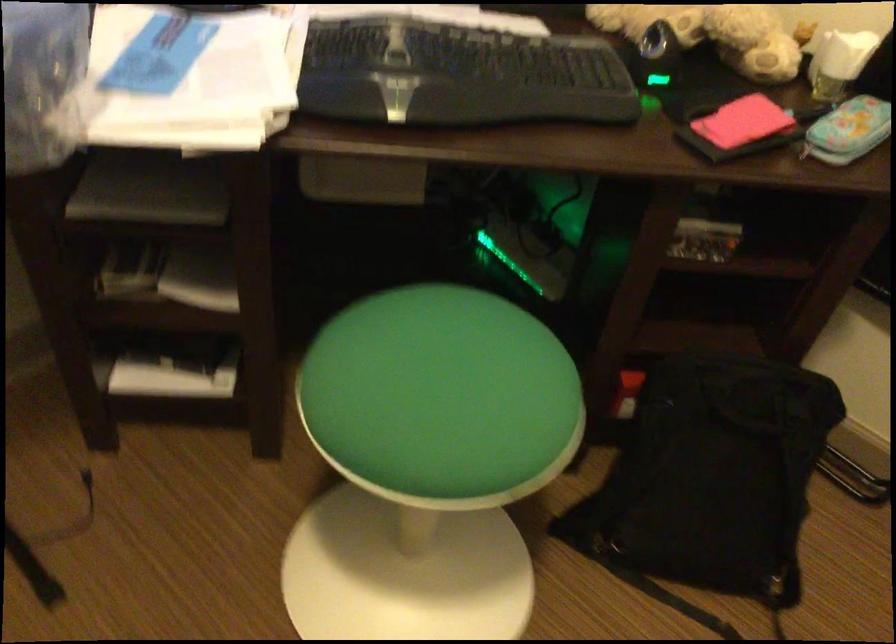
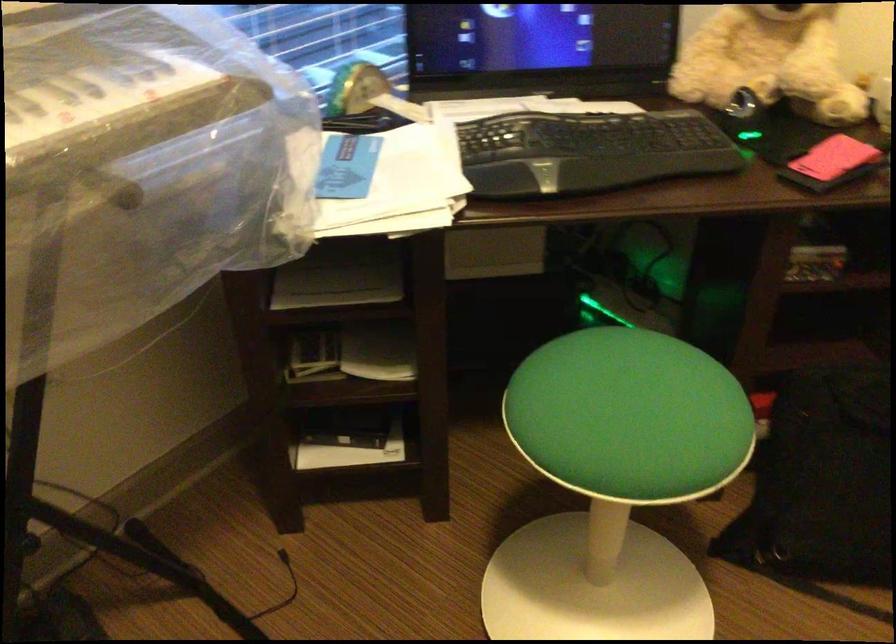
Find the pixel in the second image that matches (x=431, y=402) in the first image.

(629, 415)